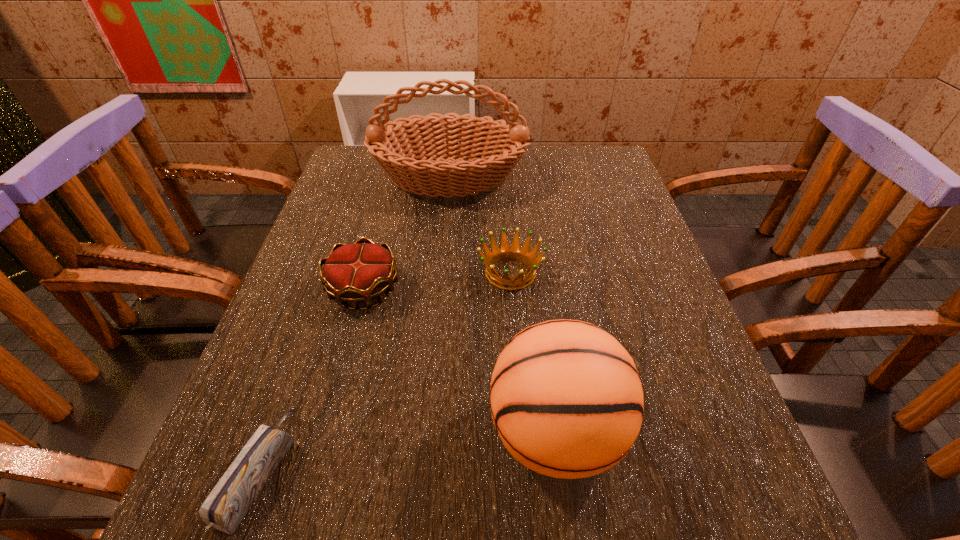
This screenshot has height=540, width=960. Identify the location of basket. (408, 156).

The image size is (960, 540). I want to click on the farthest object, so [408, 156].

Identify the location of basketball. This screenshot has width=960, height=540. (566, 399).

Identify the location of the left crown. The width and height of the screenshot is (960, 540). (355, 273).

In order to click on the right crown in this screenshot , I will do `click(514, 252)`.

The image size is (960, 540). I want to click on pencil box, so click(x=226, y=505).

This screenshot has height=540, width=960. I want to click on vacant space located 0.090m on the left of the farthest object, so click(339, 178).

The width and height of the screenshot is (960, 540). In order to click on vacant space situated 0.400m on the back of the fourth shortest object in this screenshot , I will do `click(530, 233)`.

Image resolution: width=960 pixels, height=540 pixels. Find the location of `vacant space located 0.080m on the front of the left crown`. vacant space located 0.080m on the front of the left crown is located at coordinates [x=348, y=350].

In order to click on free space located 0.170m on the front of the right crown in this screenshot , I will do `click(517, 366)`.